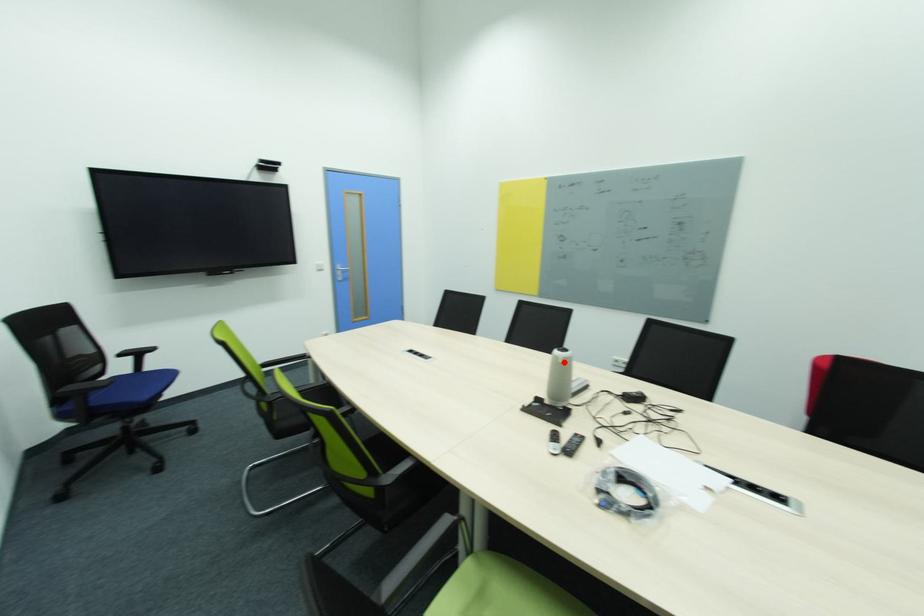
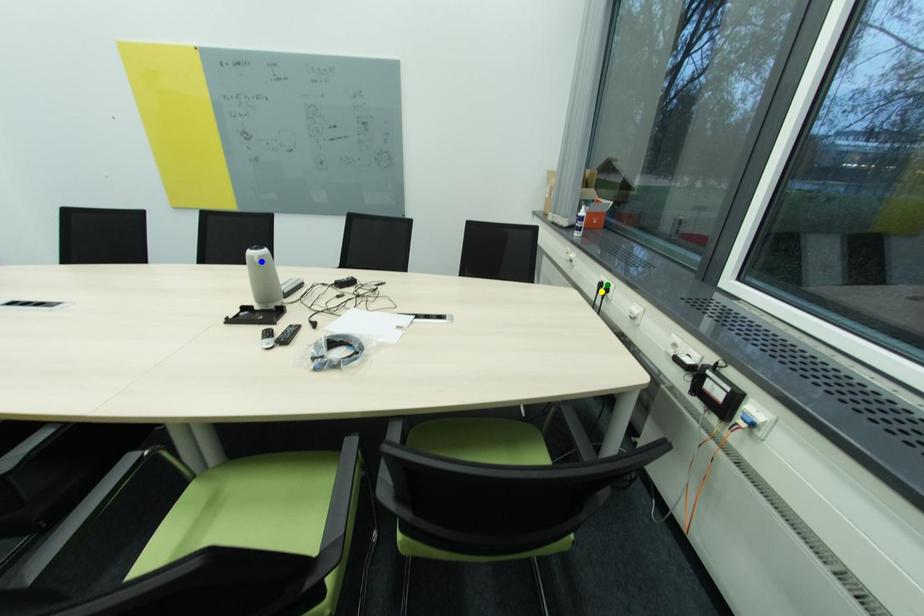
Question: I am providing you with two images of the same scene from different viewpoints. A red point is marked on the first image. You are given multiple points on the second image. In image 2, which mark is for the same physical point as the one in image 1?

Choices:
 (A) yellow point
 (B) green point
 (C) blue point

Answer: (C)